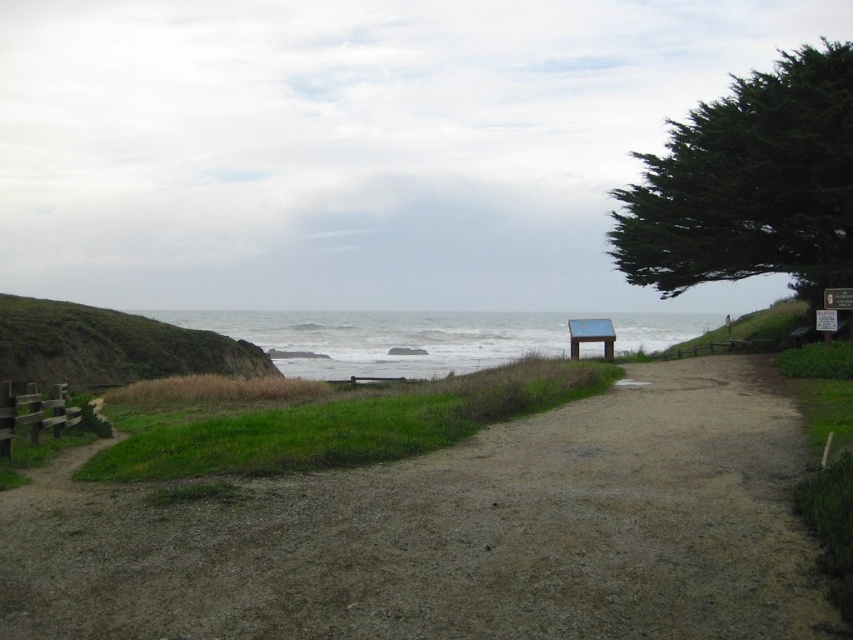
Question: Which of these objects is positioned farthest from the wooden park bench at center?

Choices:
 (A) dirt path at center
 (B) green leafy tree at upper right

Answer: (B)

Question: Which is farther from the wooden park bench at center?

Choices:
 (A) green leafy tree at upper right
 (B) dirt path at center

Answer: (A)

Question: Is dirt path at center to the right of wooden park bench at center from the viewer's perspective?

Choices:
 (A) yes
 (B) no

Answer: (B)

Question: Which of the following is the closest to the observer?

Choices:
 (A) dirt path at center
 (B) wooden park bench at center

Answer: (A)

Question: Can you confirm if dirt path at center is smaller than wooden park bench at center?

Choices:
 (A) yes
 (B) no

Answer: (A)

Question: Does dirt path at center appear over green leafy tree at upper right?

Choices:
 (A) yes
 (B) no

Answer: (B)